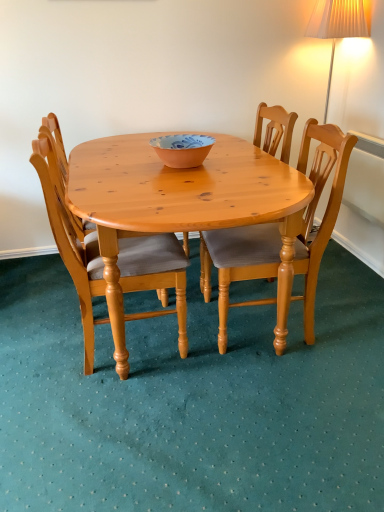
Locate an element on the screen. This screenshot has height=512, width=384. space that is in front of light brown wooden chair at center, arranged as the 1th chair when viewed from the right is located at coordinates (282, 391).